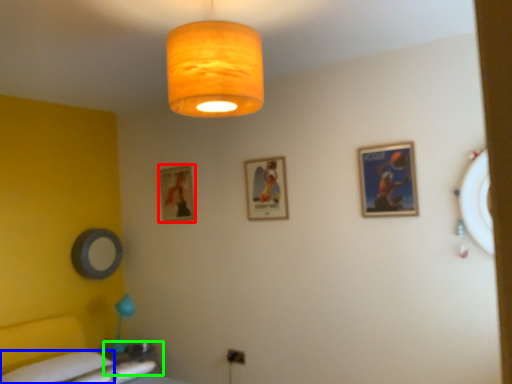
Question: Which object is positioned closest to picture frame (highlighted by a red box)? Select from sheet (highlighted by a blue box) and table (highlighted by a green box).

Choices:
 (A) sheet
 (B) table

Answer: (B)